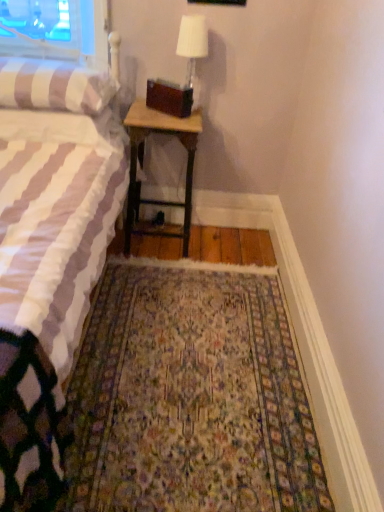
In order to click on free space in front of wooden nightstand at center in this screenshot , I will do `click(163, 271)`.